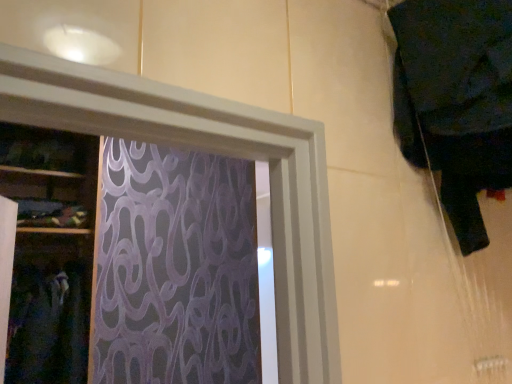
Question: Should I look upward or downward to see dark fabric at left, the 2th clothing when ordered from front to back?

Choices:
 (A) up
 (B) down

Answer: (B)

Question: Is dark fabric at upper right, positioned as the 1th clothing in top-to-bottom order, with dark fabric at left, the second clothing viewed from the top?

Choices:
 (A) no
 (B) yes

Answer: (A)

Question: Considering the relative sizes of dark fabric at upper right, positioned as the 1th clothing in top-to-bottom order, and dark fabric at left, the 2th clothing when ordered from front to back, in the image provided, is dark fabric at upper right, positioned as the 1th clothing in top-to-bottom order, smaller than dark fabric at left, the 2th clothing when ordered from front to back,?

Choices:
 (A) yes
 (B) no

Answer: (A)

Question: From a real-world perspective, is dark fabric at upper right, the 2th clothing in the left-to-right sequence, over dark fabric at left, which appears as the first clothing when viewed from the left?

Choices:
 (A) no
 (B) yes

Answer: (B)

Question: Does dark fabric at upper right, positioned as the 1th clothing in top-to-bottom order, have a greater height compared to dark fabric at left, the first clothing from the back?

Choices:
 (A) yes
 (B) no

Answer: (B)

Question: Is dark fabric at upper right, positioned as the first clothing in front-to-back order, to the left of dark fabric at left, the first clothing from the back, from the viewer's perspective?

Choices:
 (A) no
 (B) yes

Answer: (A)

Question: Does dark fabric at upper right, the 2th clothing in the bottom-to-top sequence, have a lesser width compared to dark fabric at left, marked as the 2th clothing in a right-to-left arrangement?

Choices:
 (A) yes
 (B) no

Answer: (A)

Question: Can you confirm if dark fabric at left, the 2th clothing when ordered from front to back, is positioned to the right of dark fabric at upper right, the 2th clothing in the left-to-right sequence?

Choices:
 (A) yes
 (B) no

Answer: (B)

Question: Can you confirm if dark fabric at left, the first clothing from the back, is wider than dark fabric at upper right, the 1th clothing when ordered from right to left?

Choices:
 (A) yes
 (B) no

Answer: (A)

Question: Is dark fabric at upper right, the second clothing from the back, inside dark fabric at left, marked as the 2th clothing in a right-to-left arrangement?

Choices:
 (A) no
 (B) yes

Answer: (A)

Question: Is dark fabric at left, the first clothing from the back, positioned in front of dark fabric at upper right, the 2th clothing in the bottom-to-top sequence?

Choices:
 (A) yes
 (B) no

Answer: (B)

Question: Is dark fabric at left, the first clothing from the back, further to camera compared to dark fabric at upper right, the 2th clothing in the left-to-right sequence?

Choices:
 (A) yes
 (B) no

Answer: (A)

Question: Can you confirm if dark fabric at left, the first clothing from the back, is positioned to the left of dark fabric at upper right, the 1th clothing when ordered from right to left?

Choices:
 (A) yes
 (B) no

Answer: (A)

Question: Visually, is dark fabric at left, the 2th clothing when ordered from front to back, positioned to the left or to the right of dark fabric at upper right, the 2th clothing in the bottom-to-top sequence?

Choices:
 (A) left
 (B) right

Answer: (A)